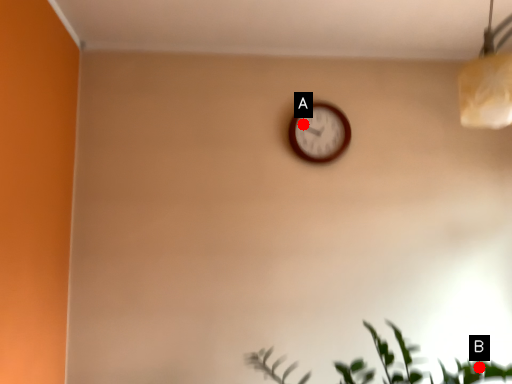
Question: Two points are circled on the image, labeled by A and B beside each circle. Which point appears closest to the camera in this image?

Choices:
 (A) A is closer
 (B) B is closer

Answer: (B)